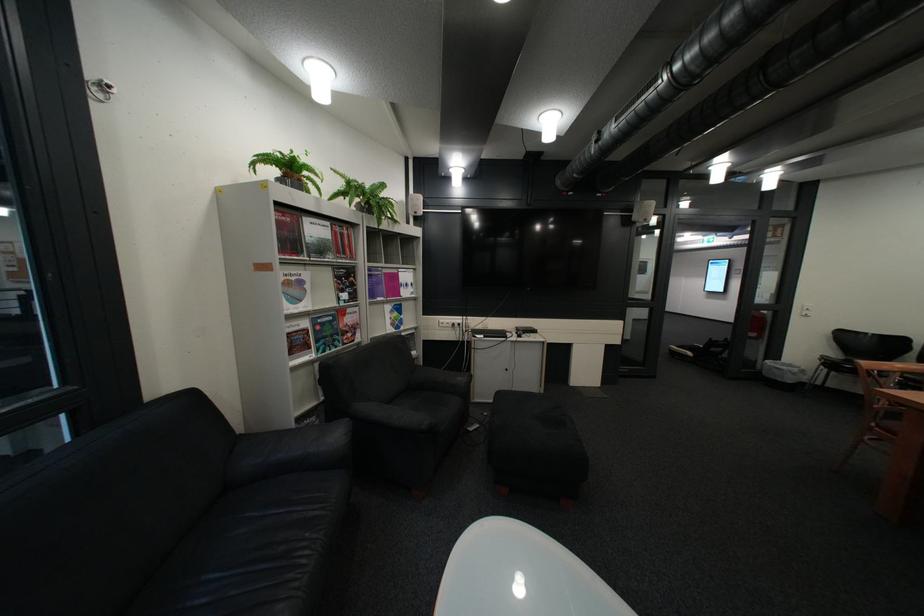
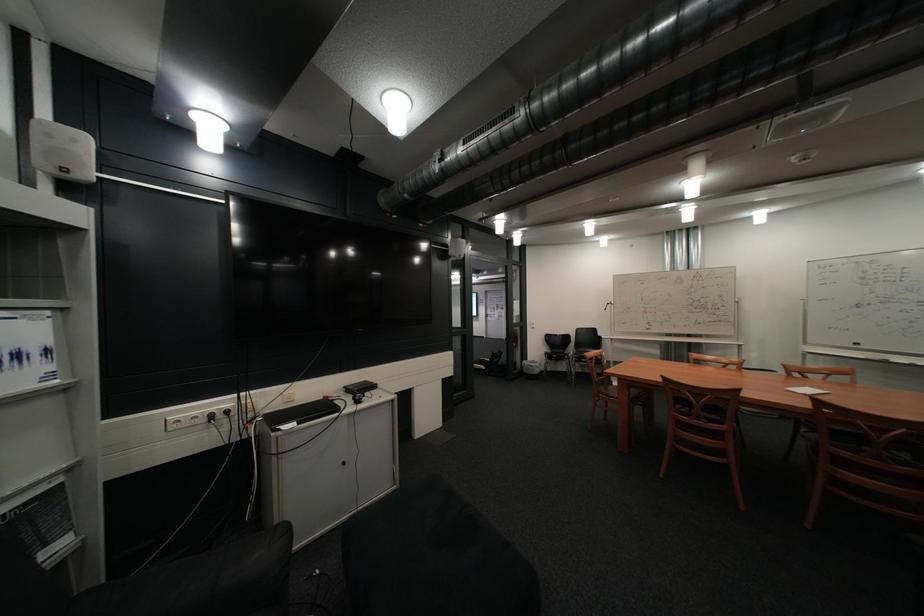
In the second image, find the point that corresponds to the point at 419,334 in the first image.

(10, 514)